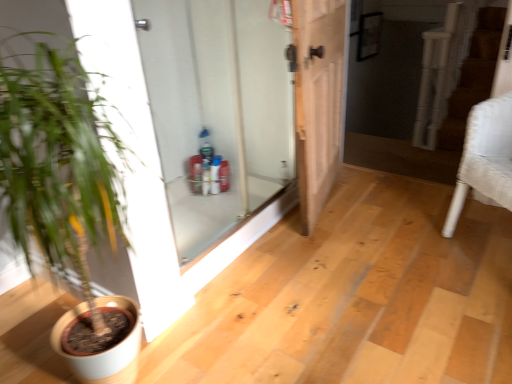
Identify the location of vacant space behind white textured armchair at right. (440, 212).